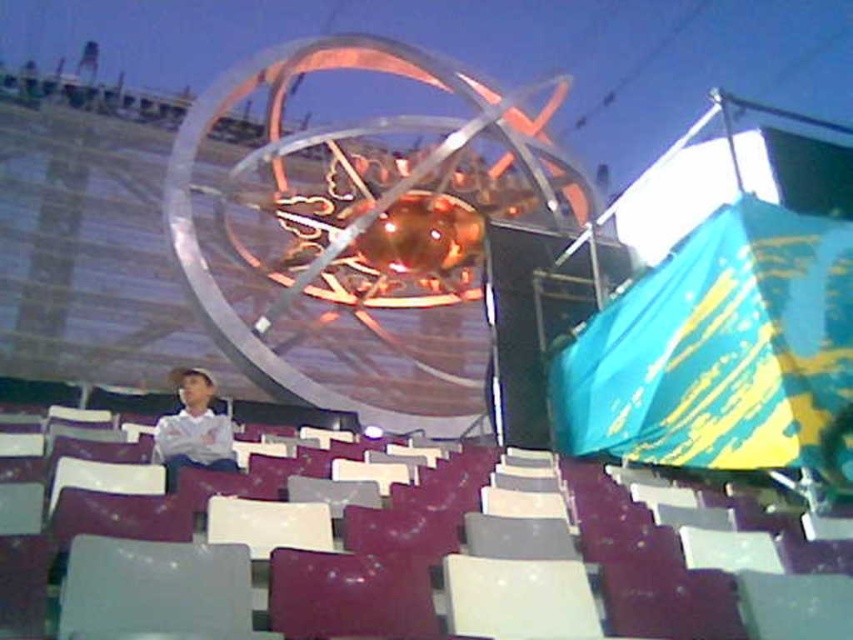
You are standing at the entrance of the stadium and see the white plastic chair at center and the white matte shirt at center. Which object is located to the right of the other?

The white plastic chair at center is positioned on the right side of white matte shirt at center.

You are planning to place a white matte shirt at center on a white plastic chair at center. Based on the provided description, will the shirt fit comfortably on the chair?

The white plastic chair at center has a smaller size compared to white matte shirt at center, so the shirt may not fit comfortably as it might be too large for the chair.